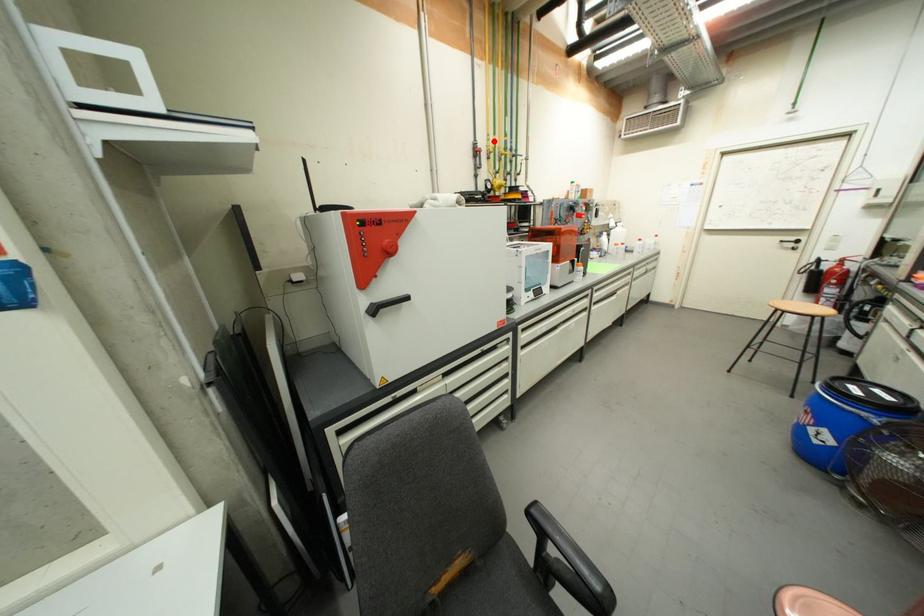
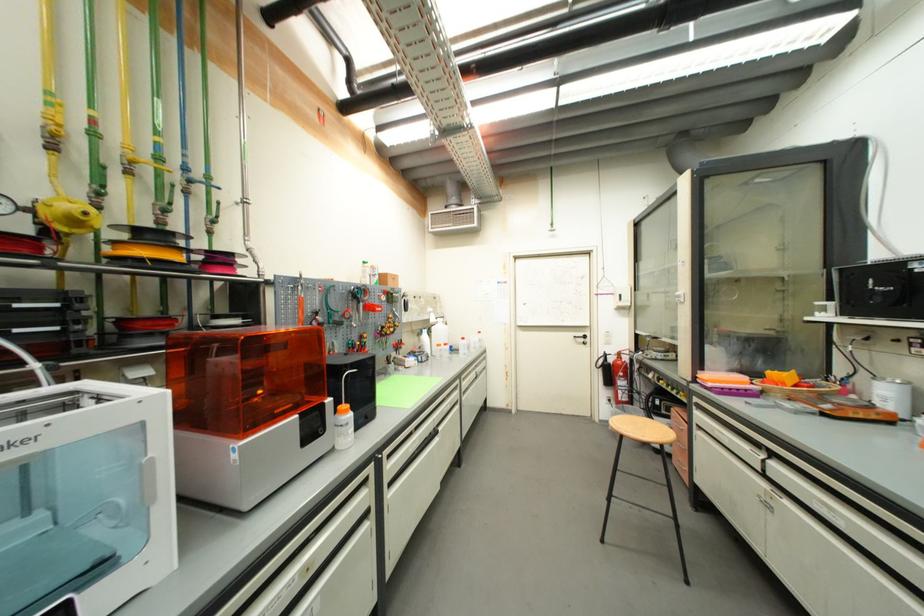
Question: I am providing you with two images of the same scene from different viewpoints. In image1, a red point is highlighted. Considering the same 3D point in image2, which of the following is correct?

Choices:
 (A) It is closer
 (B) It is farther

Answer: (B)